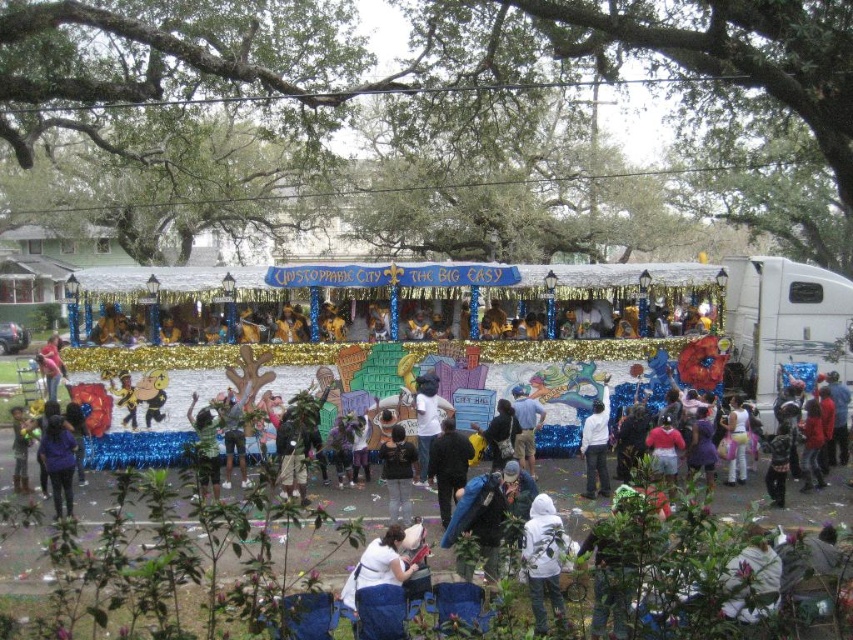
You are a photographer standing in the crowd watching the parade. You want to take a photo that includes both the point at coordinates point (393, 525) and point (514, 390). Which point should you focus on first to ensure both are in focus?

You should focus on point (393, 525) first because it is closer to you than point (514, 390), so adjusting the focus from near to far will help both points be in focus.

You are a photographer standing at the side of the parade route. You notice two people in the crowd wearing a black matte jacket at center and a white matte shirt at center. Which clothing item is closer to the ground?

The black matte jacket at center is positioned under the white matte shirt at center, so the black matte jacket at center is closer to the ground.